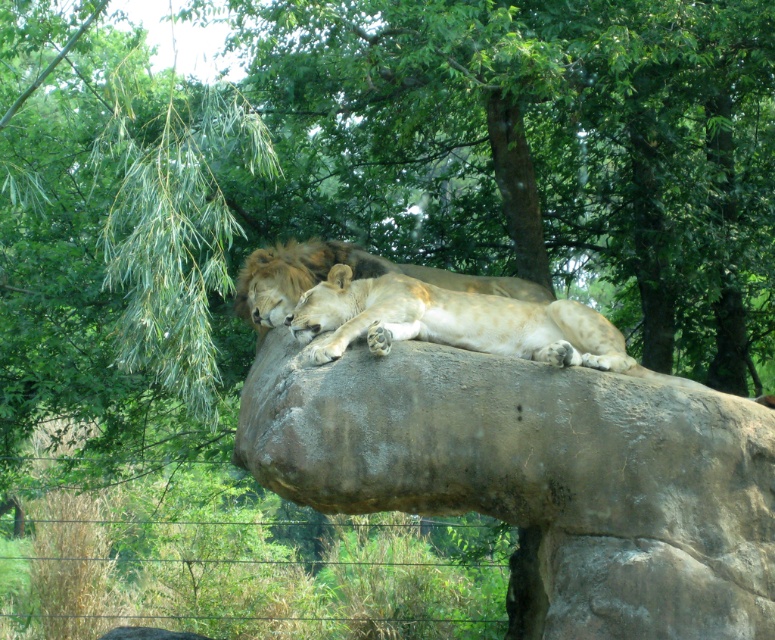
Is brown rough rock at center positioned in front of light brown fur at center?

Yes.

Does point (243, 417) come in front of point (496, 316)?

That is True.

Locate an element on the screen. The image size is (775, 640). brown rough rock at center is located at coordinates (538, 476).

Between light brown fur at center and golden fur lion at center, which one is positioned higher?

Positioned higher is golden fur lion at center.

Does light brown fur at center have a smaller size compared to golden fur lion at center?

Incorrect, light brown fur at center is not smaller in size than golden fur lion at center.

Who is more forward, (434, 314) or (405, 269)?

Positioned in front is point (434, 314).

Where is `light brown fur at center`? light brown fur at center is located at coordinates (457, 323).

Does brown rough rock at center appear on the left side of golden fur lion at center?

In fact, brown rough rock at center is to the right of golden fur lion at center.

Is point (362, 477) more distant than point (314, 257)?

No, it is in front of (314, 257).

Find the location of a particular element. brown rough rock at center is located at coordinates (538, 476).